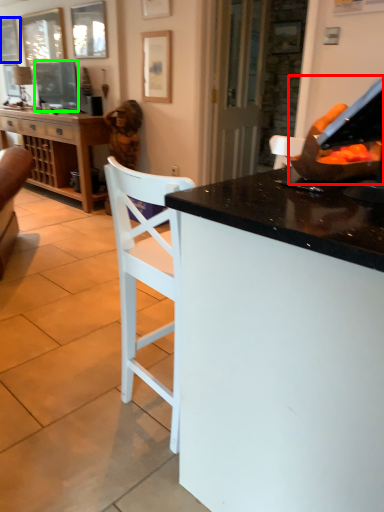
Question: Which is farther away from appliance (highlighted by a red box)? picture frame (highlighted by a blue box) or television (highlighted by a green box)?

Choices:
 (A) picture frame
 (B) television

Answer: (A)